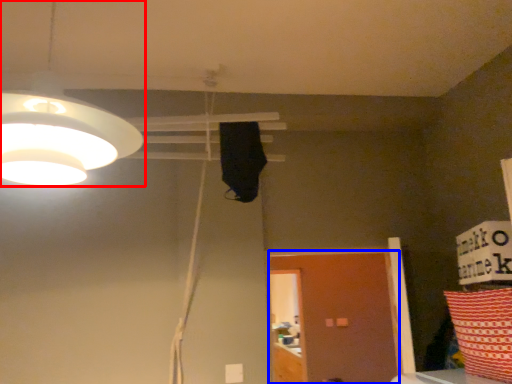
Question: Which of the following is the farthest to the observer, lamp (highlighted by a red box) or door (highlighted by a blue box)?

Choices:
 (A) lamp
 (B) door

Answer: (B)